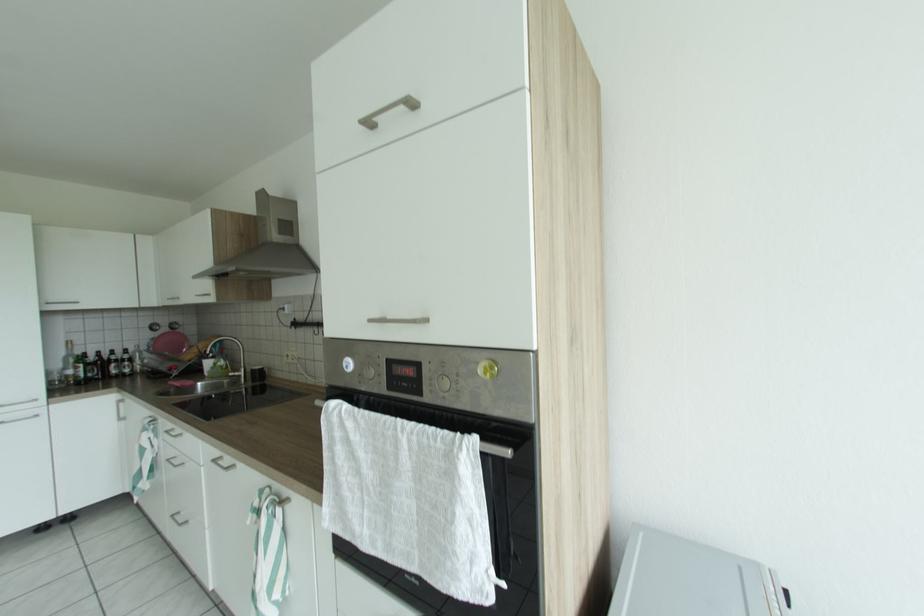
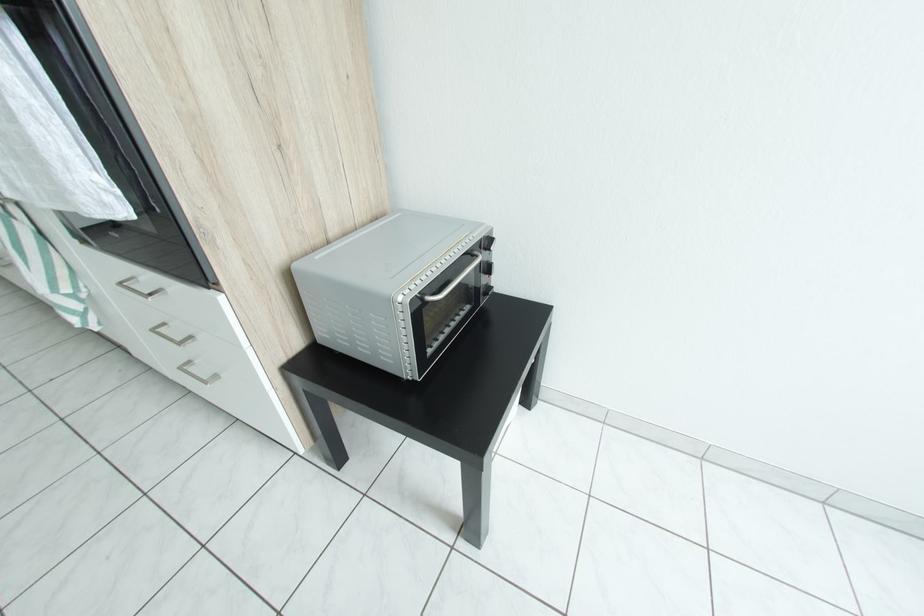
Question: Based on the continuous images, in which direction is the camera rotating? Reply with the corresponding letter.

Choices:
 (A) Left
 (B) Right
 (C) Up
 (D) Down

Answer: (D)